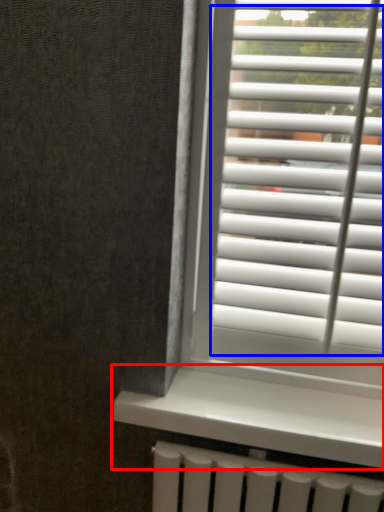
Question: Which of the following is the closest to the observer, window sill (highlighted by a red box) or blind (highlighted by a blue box)?

Choices:
 (A) window sill
 (B) blind

Answer: (B)